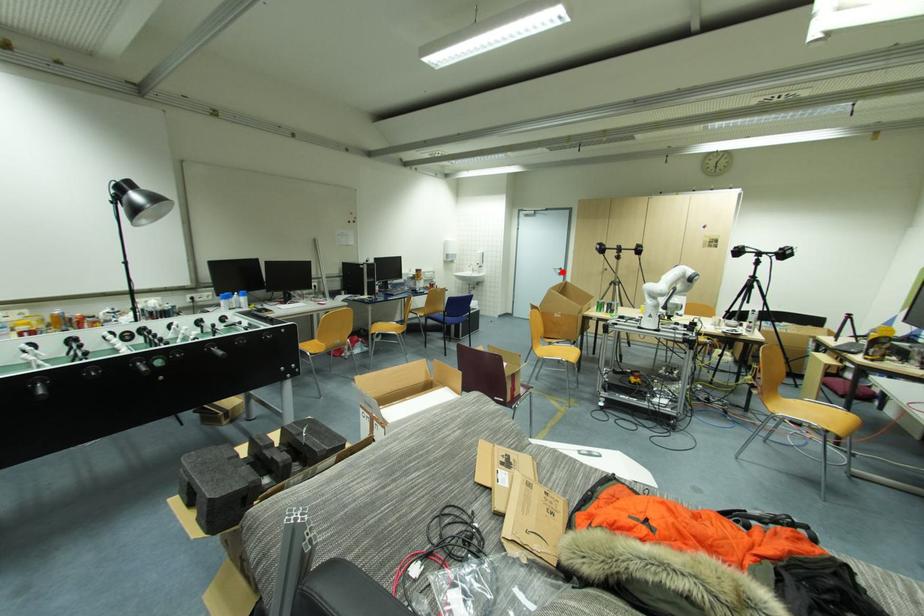
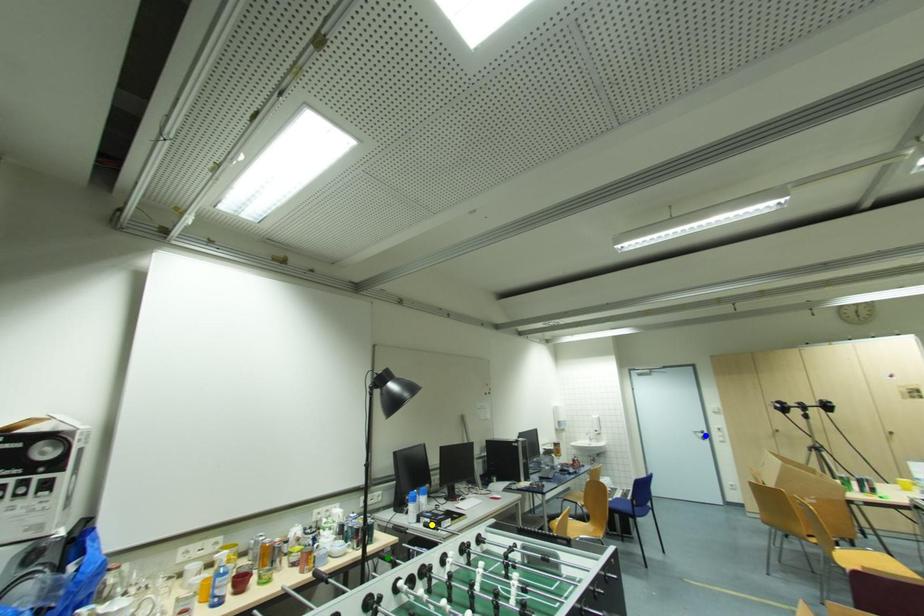
Question: I am providing you with two images of the same scene from different viewpoints. A red point is marked on the first image. You are given multiple points on the second image. Can you choose the point in image 2 that corresponds to the point in image 1?

Choices:
 (A) blue point
 (B) yellow point
 (C) green point

Answer: (A)